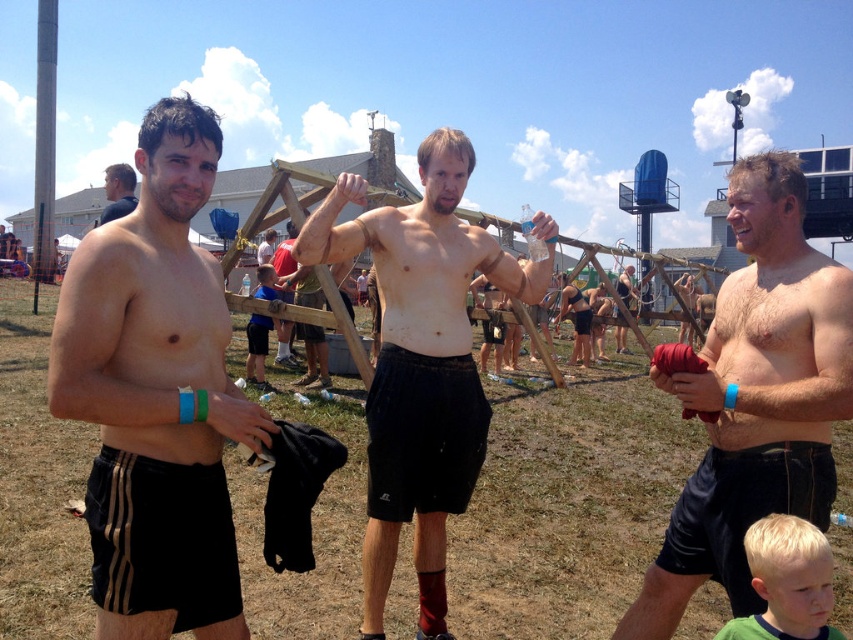
Question: Is matte black shorts at left below matte black shorts at center?

Choices:
 (A) yes
 (B) no

Answer: (B)

Question: Which point is closer to the camera?

Choices:
 (A) smooth black shorts at right
 (B) black matte shorts at left
 (C) blue t-shirt at center

Answer: (B)

Question: Estimate the real-world distances between objects in this image. Which object is farther from the smooth skin torso at center?

Choices:
 (A) smooth black shorts at right
 (B) matte black shorts at left
 (C) blonde hair at lower right

Answer: (B)

Question: Which object is closer to the camera taking this photo?

Choices:
 (A) blue t-shirt at center
 (B) smooth skin torso at center
 (C) black matte shorts at left

Answer: (C)

Question: Is blonde hair at lower right further to the viewer compared to matte black shorts at center?

Choices:
 (A) no
 (B) yes

Answer: (A)

Question: Does blonde hair at lower right appear on the left side of blue t-shirt at center?

Choices:
 (A) no
 (B) yes

Answer: (A)